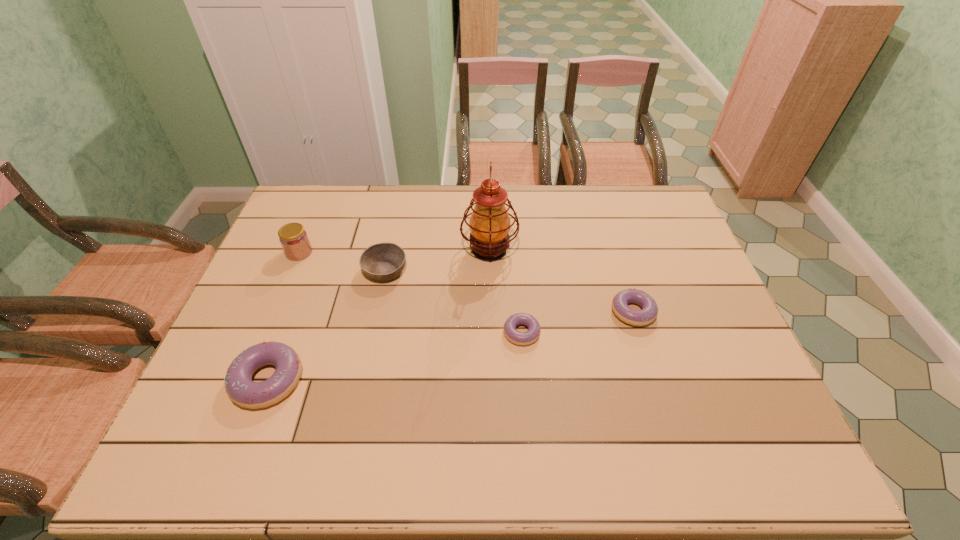
I want to click on the nearest doughnut, so click(x=240, y=388).

At what (x,y) coordinates should I click in order to perform the action: click on the nearest object. Please return your answer as a coordinate pair (x, y). Looking at the image, I should click on (240, 388).

Find the location of a particular element. This screenshot has width=960, height=540. the second doughnut from left to right is located at coordinates (519, 338).

Locate an element on the screen. The width and height of the screenshot is (960, 540). the shortest object is located at coordinates (519, 338).

You are a GUI agent. You are given a task and a screenshot of the screen. Output one action in this format:
    pyautogui.click(x=<x>, y=<y>)
    Task: Click on the fifth tallest object
    The width and height of the screenshot is (960, 540).
    Given the screenshot: What is the action you would take?
    pyautogui.click(x=649, y=312)

Identify the location of the second tallest doughnut. (649, 312).

Locate an element on the screen. This screenshot has width=960, height=540. jam is located at coordinates (294, 240).

Where is `oil lamp`? This screenshot has width=960, height=540. oil lamp is located at coordinates (489, 224).

Find the location of a particular element. This screenshot has height=540, width=960. the fourth object from right to left is located at coordinates (384, 261).

This screenshot has width=960, height=540. What are the coordinates of `free space located on the back of the nearest doughnut` in the screenshot? It's located at (315, 255).